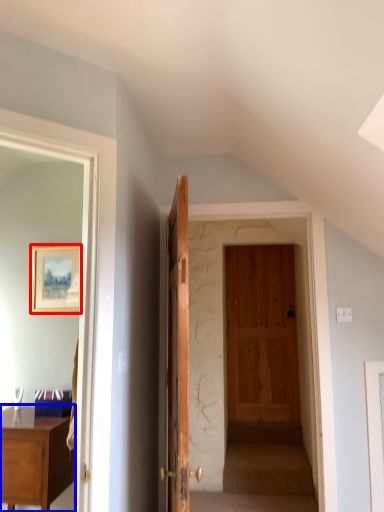
Question: Which of the following is the closest to the observer, picture frame (highlighted by a red box) or desk (highlighted by a blue box)?

Choices:
 (A) picture frame
 (B) desk

Answer: (B)